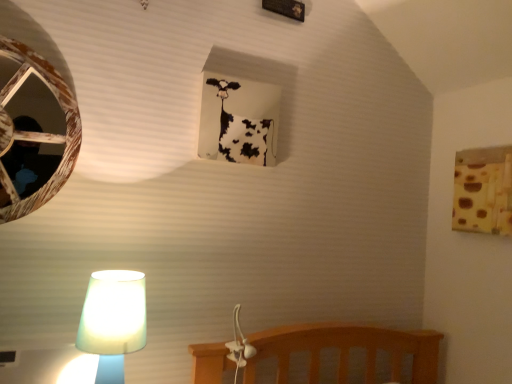
Question: Considering the relative sizes of white paper at upper center, positioned as the 1th window frame in top-to-bottom order, and translucent glass lamp at lower left in the image provided, is white paper at upper center, positioned as the 1th window frame in top-to-bottom order, shorter than translucent glass lamp at lower left?

Choices:
 (A) no
 (B) yes

Answer: (A)

Question: Is white paper at upper center, positioned as the 1th window frame in top-to-bottom order, at the right side of translucent glass lamp at lower left?

Choices:
 (A) yes
 (B) no

Answer: (A)

Question: From the image's perspective, would you say white paper at upper center, the second window frame from the bottom, is shown under translucent glass lamp at lower left?

Choices:
 (A) no
 (B) yes

Answer: (A)

Question: Is white paper at upper center, the first window frame positioned from the left, bigger than translucent glass lamp at lower left?

Choices:
 (A) no
 (B) yes

Answer: (A)

Question: Is the depth of white paper at upper center, the first window frame positioned from the left, greater than that of translucent glass lamp at lower left?

Choices:
 (A) no
 (B) yes

Answer: (B)

Question: Are white paper at upper center, the second window frame from the bottom, and translucent glass lamp at lower left beside each other?

Choices:
 (A) no
 (B) yes

Answer: (A)

Question: Is translucent glass lamp at lower left thinner than wooden birdhouse at left?

Choices:
 (A) no
 (B) yes

Answer: (A)

Question: From a real-world perspective, is translucent glass lamp at lower left beneath wooden birdhouse at left?

Choices:
 (A) no
 (B) yes

Answer: (B)

Question: From the image's perspective, is translucent glass lamp at lower left beneath wooden birdhouse at left?

Choices:
 (A) no
 (B) yes

Answer: (B)

Question: Is wooden birdhouse at left completely or partially inside translucent glass lamp at lower left?

Choices:
 (A) no
 (B) yes

Answer: (A)

Question: From the image's perspective, would you say translucent glass lamp at lower left is positioned over wooden birdhouse at left?

Choices:
 (A) no
 (B) yes

Answer: (A)

Question: From a real-world perspective, is translucent glass lamp at lower left positioned over wooden birdhouse at left based on gravity?

Choices:
 (A) yes
 (B) no

Answer: (B)

Question: Considering the relative sizes of wooden birdhouse at left and white paper at upper center, positioned as the 1th window frame in top-to-bottom order, in the image provided, is wooden birdhouse at left smaller than white paper at upper center, positioned as the 1th window frame in top-to-bottom order,?

Choices:
 (A) yes
 (B) no

Answer: (B)